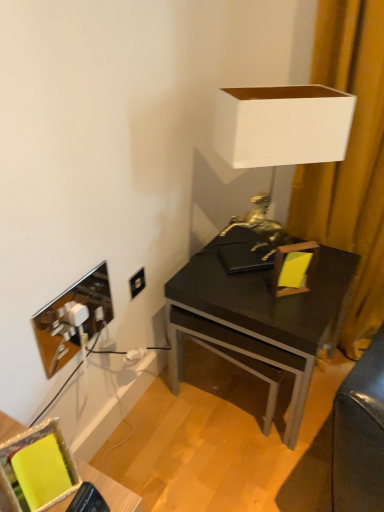
Locate an element on the screen. free space in front of matte black desk at center is located at coordinates (243, 463).